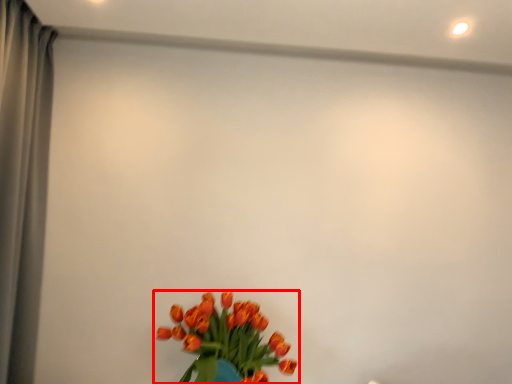
Question: From the image's perspective, where is flower (annotated by the red box) located relative to curtain?

Choices:
 (A) above
 (B) below

Answer: (B)